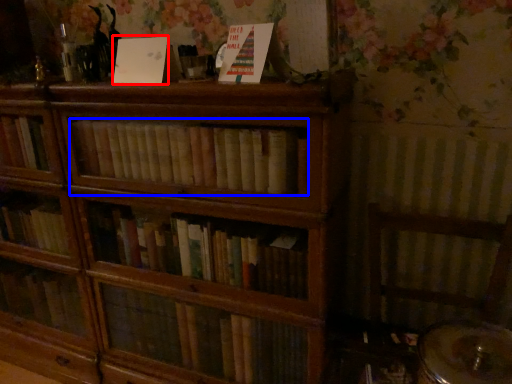
Question: Which point is further to the camera, paperback book (highlighted by a red box) or book (highlighted by a blue box)?

Choices:
 (A) paperback book
 (B) book

Answer: (A)